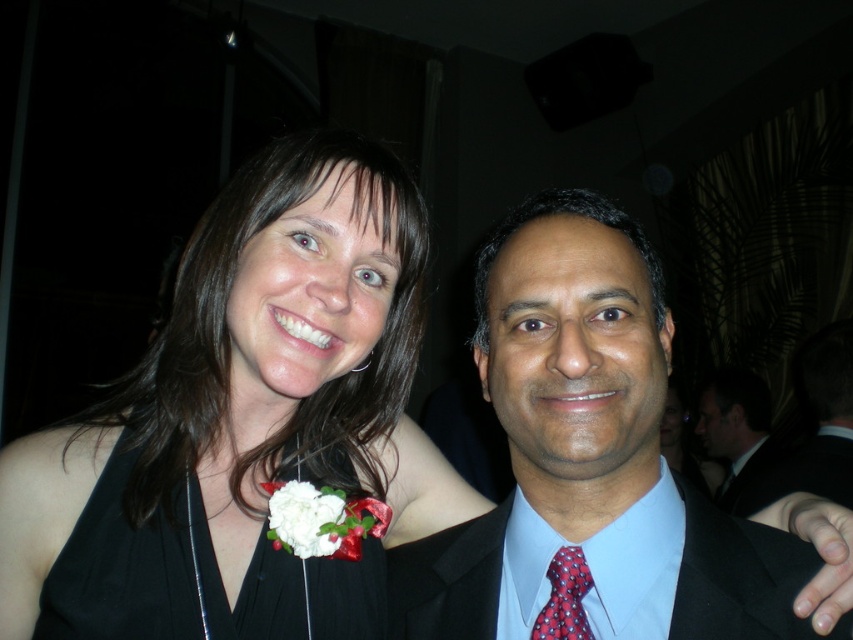
You are a photographer at a formal event. You need to ensure that both the black satin dress at center and the dark blue satin suit at center fit within the frame of your camera. Given that the camera frame can only accommodate a total width of 1.8 meters, can you confirm if their combined widths will fit?

The black satin dress at center is wider than the dark blue satin suit at center. However, without knowing the exact widths of each, it is impossible to determine if their combined widths will fit within the 1.8 meters frame limit.

You are a photographer adjusting the focus on your camera. You want to ensure both the dark blue satin suit at center and the red dotted tie at center are in focus. Which object should you focus on first to achieve this?

To ensure both the dark blue satin suit at center and the red dotted tie at center are in focus, you should focus on the dark blue satin suit at center first since it is closer to the viewer. This allows the depth of field to extend backward to include the red dotted tie at center.